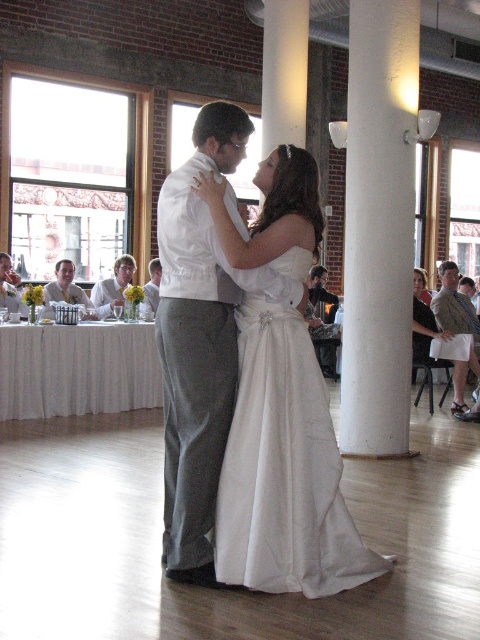
Does dark brown leather jacket at center have a greater width compared to matte white dress at center?

Incorrect, dark brown leather jacket at center's width does not surpass matte white dress at center's.

In order to click on dark brown leather jacket at center in this screenshot , I will do `click(323, 301)`.

Identify the location of dark brown leather jacket at center. The width and height of the screenshot is (480, 640). (323, 301).

Between dark brown leather jacket at center and matte gray suit at center, which one appears on the right side from the viewer's perspective?

From the viewer's perspective, dark brown leather jacket at center appears more on the right side.

Does point (324, 360) lie in front of point (156, 269)?

No, it is behind (156, 269).

Does point (309, 317) come in front of point (160, 273)?

No, it is not.

Locate an element on the screen. This screenshot has height=640, width=480. dark brown leather jacket at center is located at coordinates (323, 301).

Is white satin dress at center to the right of matte gray suit at center from the viewer's perspective?

Yes, white satin dress at center is to the right of matte gray suit at center.

This screenshot has width=480, height=640. Describe the element at coordinates (284, 468) in the screenshot. I see `white satin dress at center` at that location.

Where is `white satin dress at center`? white satin dress at center is located at coordinates (284, 468).